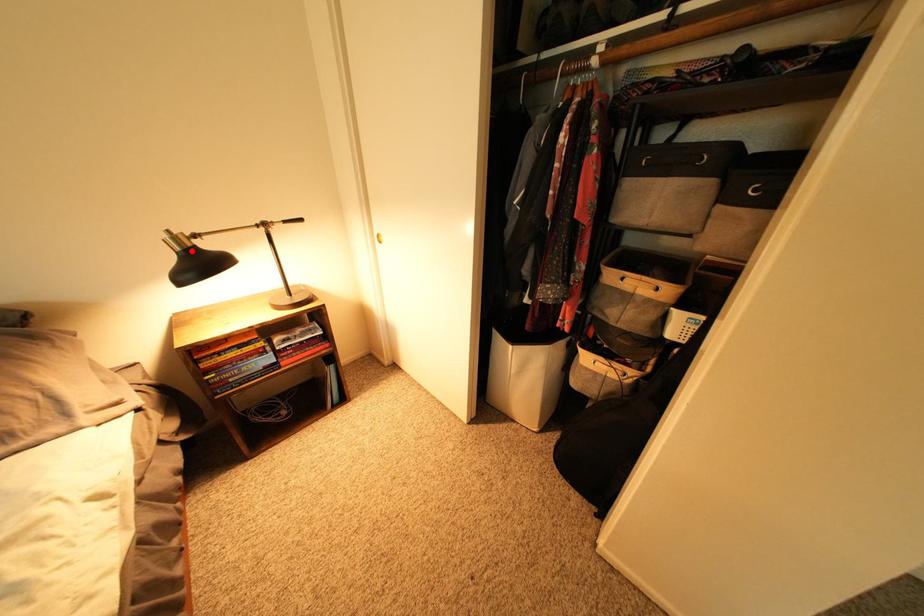
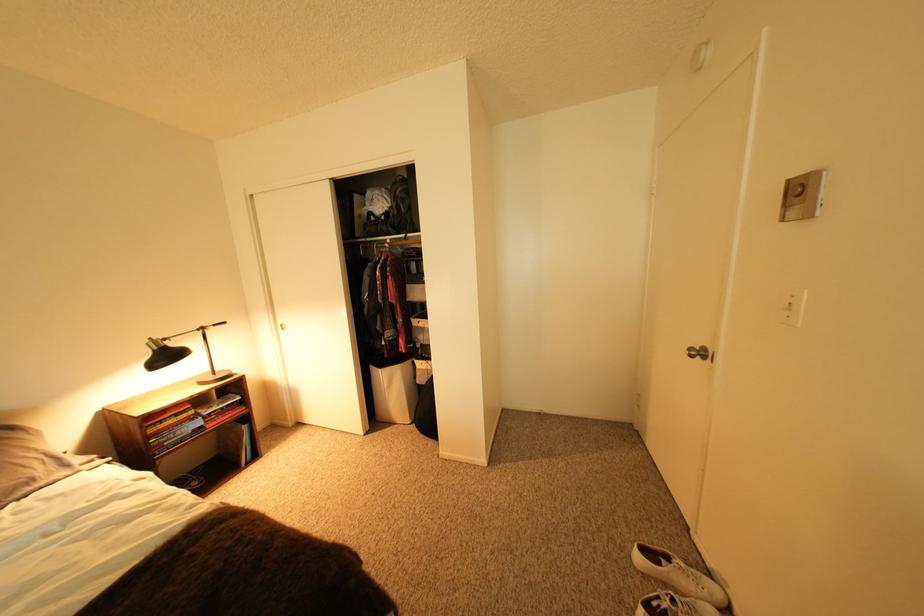
The point at the highlighted location is marked in the first image. Where is the corresponding point in the second image?

(168, 350)